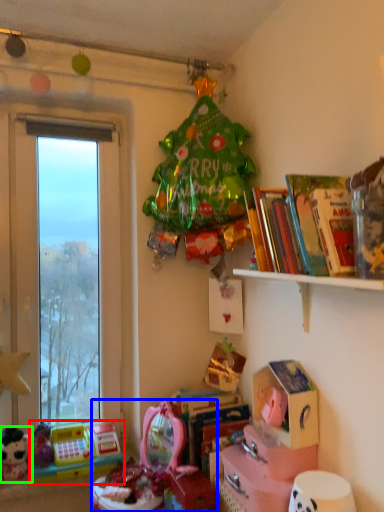
Question: Based on their relative distances, which object is nearer to toy (highlighted by a red box)? Choose from toy (highlighted by a blue box) and toy (highlighted by a green box).

Choices:
 (A) toy
 (B) toy

Answer: (B)